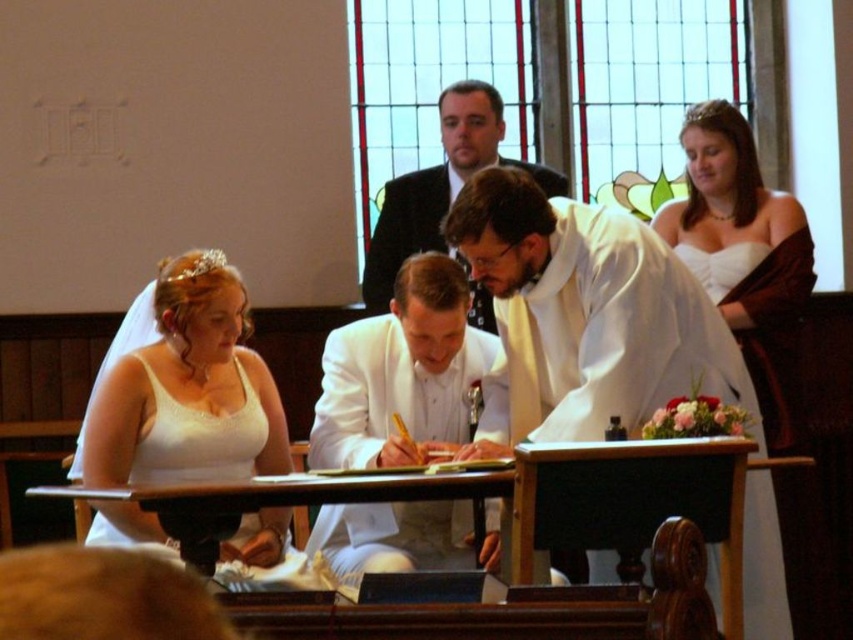
Question: Which of the following is the closest to the observer?

Choices:
 (A) white matte suit at center
 (B) white satin dress at left

Answer: (B)

Question: Is wooden table at center to the left of white matte suit at center from the viewer's perspective?

Choices:
 (A) no
 (B) yes

Answer: (B)

Question: Among these points, which one is nearest to the camera?

Choices:
 (A) (498, 122)
 (B) (515, 272)
 (C) (260, 371)
 (D) (450, 429)

Answer: (B)

Question: Which point appears closest to the camera in this image?

Choices:
 (A) [x=408, y=397]
 (B) [x=738, y=173]
 (C) [x=440, y=196]

Answer: (A)

Question: Does white matte vestment at center have a lesser width compared to wooden table at center?

Choices:
 (A) no
 (B) yes

Answer: (B)

Question: Is the position of white matte vestment at center less distant than that of white satin dress at upper right?

Choices:
 (A) no
 (B) yes

Answer: (B)